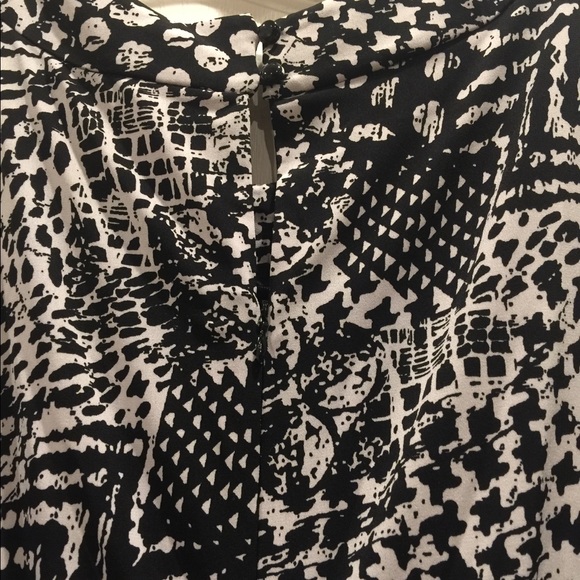
You are a GUI agent. You are given a task and a screenshot of the screen. Output one action in this format:
    pyautogui.click(x=<x>, y=<y>)
    Task: Click on the white molding
    
    Given the screenshot: What is the action you would take?
    pyautogui.click(x=293, y=1)